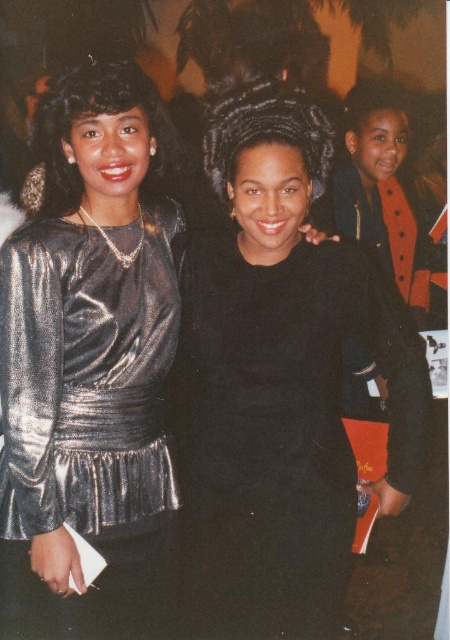
Is black matte dress at center below metallic silver dress at center?

No, black matte dress at center is not below metallic silver dress at center.

Can you confirm if black matte dress at center is thinner than metallic silver dress at center?

Correct, black matte dress at center's width is less than metallic silver dress at center's.

Measure the distance between point (220, 269) and camera.

Point (220, 269) is 1.36 meters from camera.

The height and width of the screenshot is (640, 450). Find the location of `black matte dress at center`. black matte dress at center is located at coordinates (279, 381).

The height and width of the screenshot is (640, 450). What do you see at coordinates (279, 381) in the screenshot? I see `black matte dress at center` at bounding box center [279, 381].

Is point (187, 550) farther from camera compared to point (125, 422)?

Yes, it is behind point (125, 422).

The image size is (450, 640). What do you see at coordinates (279, 381) in the screenshot?
I see `black matte dress at center` at bounding box center [279, 381].

Identify the location of black matte dress at center. (279, 381).

Is metallic silver dress at center further to camera compared to shiny metallic dress at left?

No, metallic silver dress at center is in front of shiny metallic dress at left.

What do you see at coordinates (90, 365) in the screenshot? This screenshot has height=640, width=450. I see `metallic silver dress at center` at bounding box center [90, 365].

Locate an element on the screen. This screenshot has width=450, height=640. metallic silver dress at center is located at coordinates (90, 365).